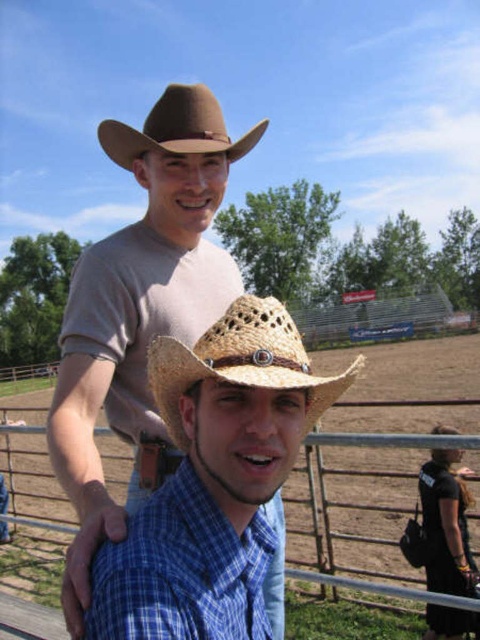
Question: Does woven straw hat at center appear under metallic wire fence at lower center?

Choices:
 (A) no
 (B) yes

Answer: (A)

Question: Can you confirm if blue plaid shirt at center is positioned below black fabric at lower right?

Choices:
 (A) yes
 (B) no

Answer: (B)

Question: Which object appears farthest from the camera in this image?

Choices:
 (A) woven straw hat at center
 (B) matte brown cowboy hat at upper center
 (C) brown felt cowboy hat at upper center

Answer: (C)

Question: Which point is farther to the camera?

Choices:
 (A) woven straw hat at center
 (B) brown felt cowboy hat at upper center

Answer: (B)

Question: Is matte brown cowboy hat at upper center further to camera compared to blue plaid shirt at center?

Choices:
 (A) yes
 (B) no

Answer: (A)

Question: Among these points, which one is farthest from the camera?

Choices:
 (A) (170, 106)
 (B) (224, 378)
 (C) (429, 442)
 (D) (431, 500)

Answer: (D)